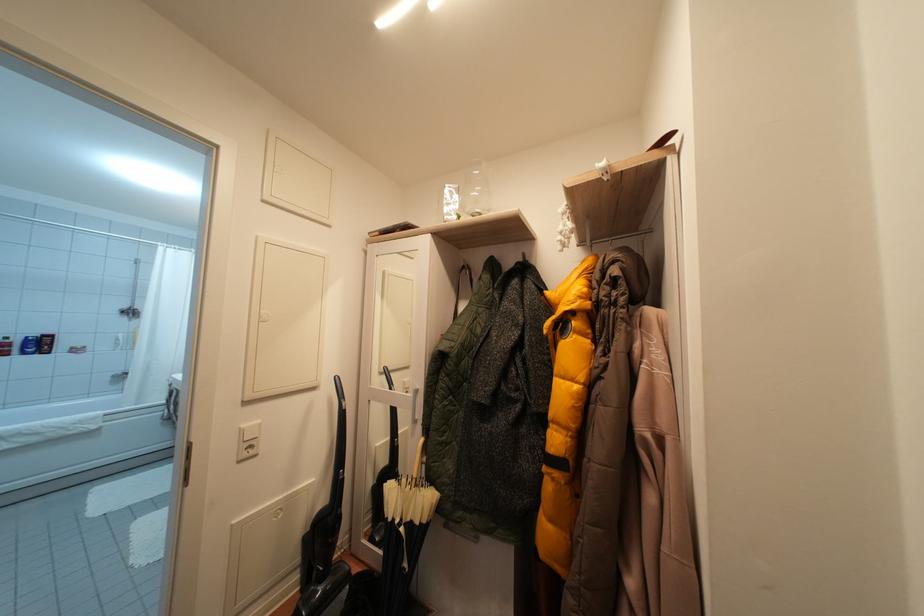
Locate an element on the screen. This screenshot has width=924, height=616. vacuum cleaner handle is located at coordinates (338, 451).